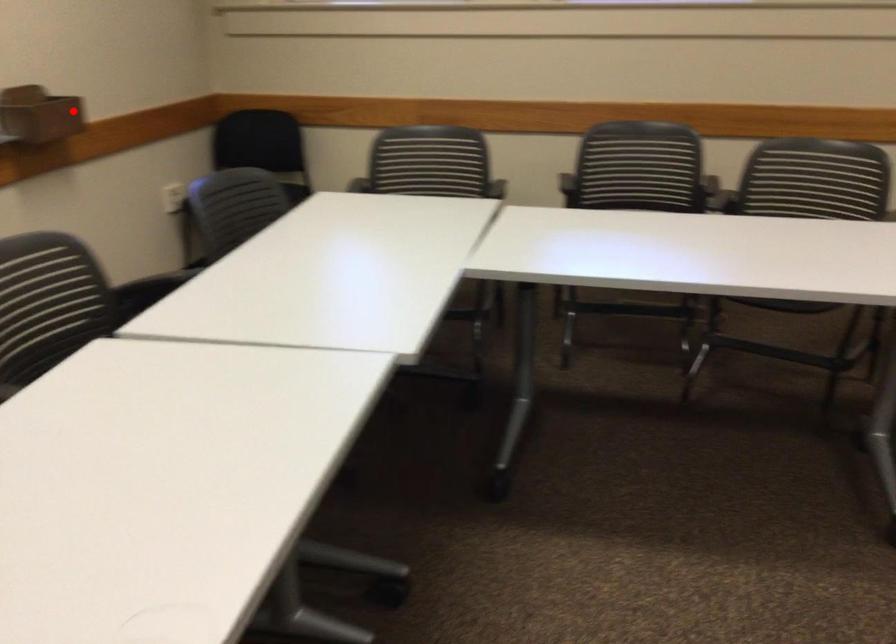
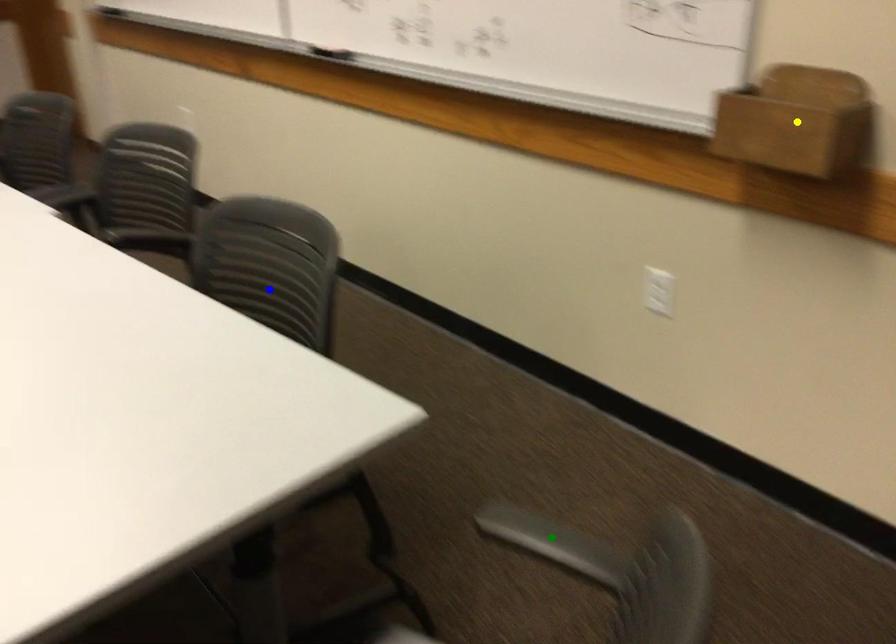
Question: I am providing you with two images of the same scene from different viewpoints. A red point is marked on the first image. You are given multiple points on the second image. Which point in image 2 represents the same 3d spot as the red point in image 1?

Choices:
 (A) yellow point
 (B) green point
 (C) blue point

Answer: (A)